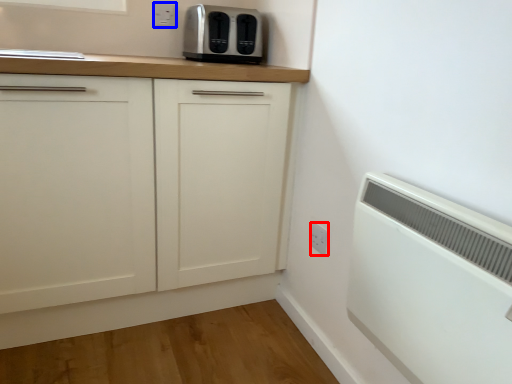
Question: Which object appears farthest to the camera in this image, electric outlet (highlighted by a red box) or electric outlet (highlighted by a blue box)?

Choices:
 (A) electric outlet
 (B) electric outlet

Answer: (B)